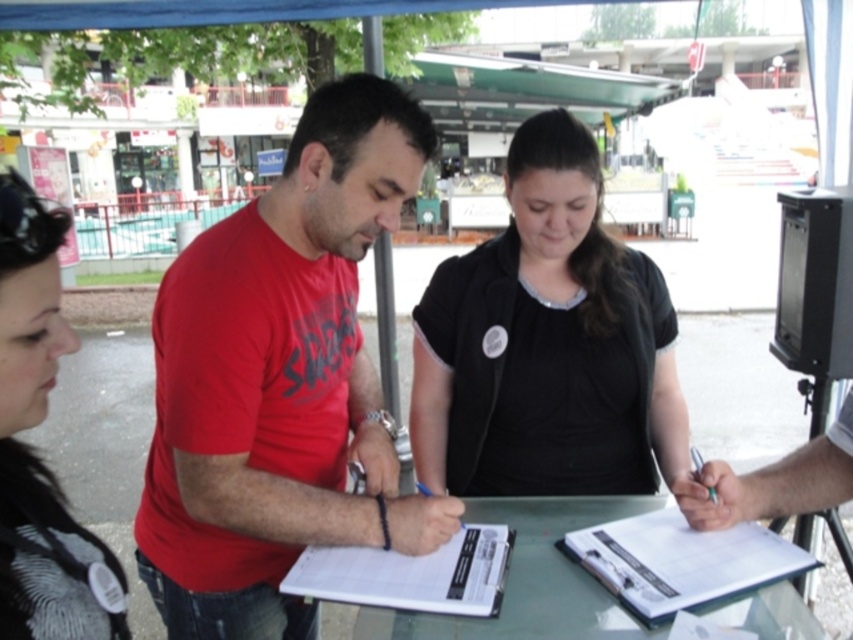
Is point (254, 602) positioned behind point (305, 582)?

Yes.

Is point (169, 288) positioned in front of point (479, 616)?

No, it is not.

Where is `matte red t-shirt at center`? matte red t-shirt at center is located at coordinates (280, 380).

Which of these two, black matte vest at center or green glass table at center, stands taller?

With more height is black matte vest at center.

Is point (502, 384) farther from viewer compared to point (596, 636)?

Yes, it is behind point (596, 636).

Who is more forward, (622,396) or (350,620)?

Point (622,396) is more forward.

This screenshot has height=640, width=853. What are the coordinates of `black matte vest at center` in the screenshot? It's located at (547, 344).

Which of these two, knitted gray scarf at lower left or white paper at center, stands shorter?

white paper at center

Identify the location of knitted gray scarf at lower left. This screenshot has height=640, width=853. (32, 451).

The width and height of the screenshot is (853, 640). What are the coordinates of `knitted gray scarf at lower left` in the screenshot? It's located at (32, 451).